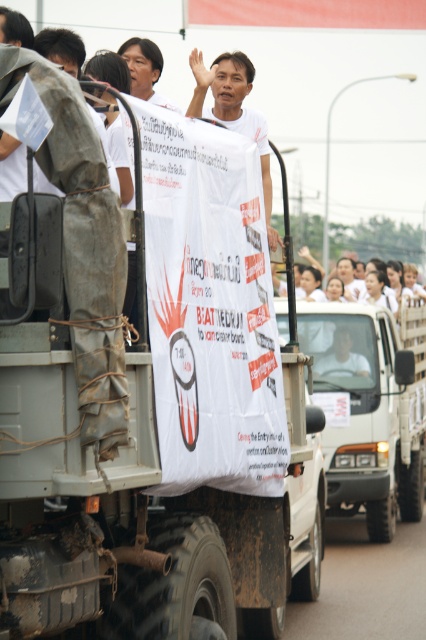
This screenshot has width=426, height=640. What are the coordinates of `rusty metal suit at left` in the screenshot? It's located at (83, 244).

Who is taller, rusty metal suit at left or white matte banner at center?

rusty metal suit at left is taller.

Which is behind, point (81, 419) or point (199, 83)?

Point (199, 83)

In order to click on rusty metal suit at left in this screenshot , I will do `click(83, 244)`.

Who is positioned more to the right, white matte truck at center or rusty metal suit at left?

Positioned to the right is white matte truck at center.

Is point (389, 314) positioned after point (100, 353)?

Yes, point (389, 314) is behind point (100, 353).

Locate an element on the screen. The image size is (426, 640). white matte truck at center is located at coordinates (370, 406).

Consider the image. Is white matte truck at center positioned behind white matte banner at center?

Yes, it is.

Measure the distance between white matte truck at center and white matte banner at center.

The distance of white matte truck at center from white matte banner at center is 5.51 meters.

What do you see at coordinates (370, 406) in the screenshot? The width and height of the screenshot is (426, 640). I see `white matte truck at center` at bounding box center [370, 406].

Find the location of a particular element. The image size is (426, 640). white matte truck at center is located at coordinates (370, 406).